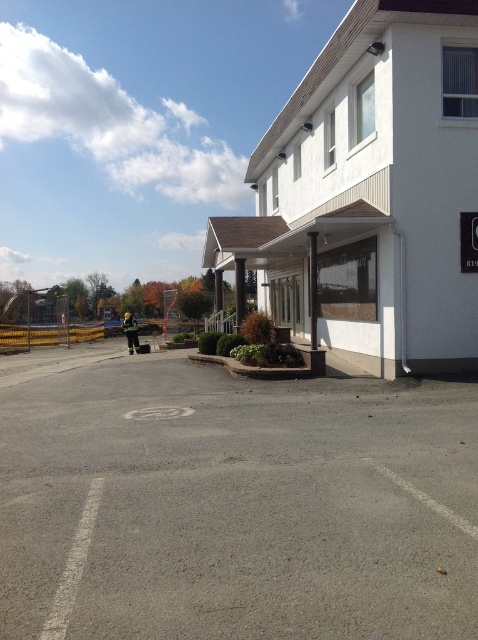
Can you confirm if gray asphalt parking lot at center is positioned below white smooth building at center?

Yes, gray asphalt parking lot at center is below white smooth building at center.

Which is in front, point (436, 563) or point (375, 108)?

Positioned in front is point (436, 563).

Where is `gray asphalt parking lot at center`? gray asphalt parking lot at center is located at coordinates (231, 502).